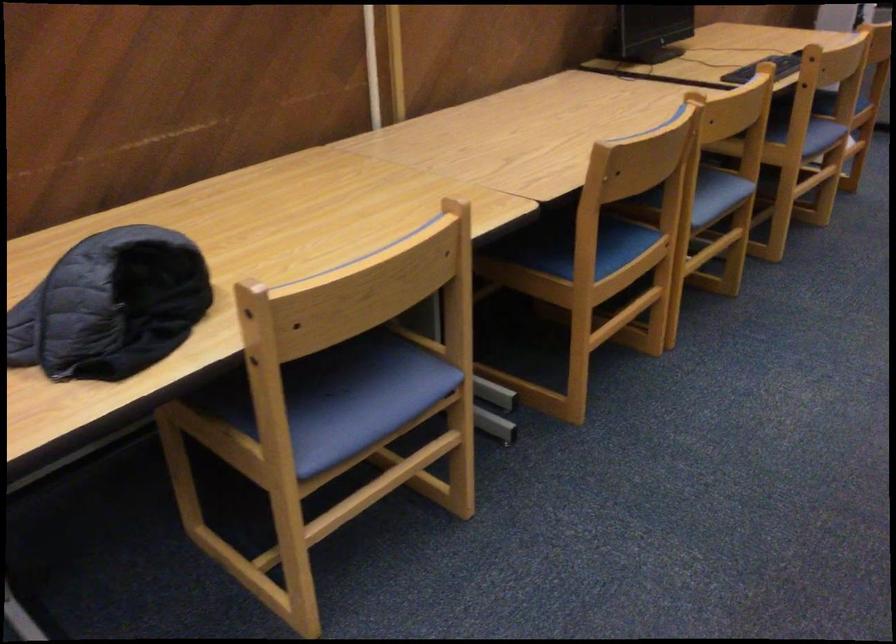
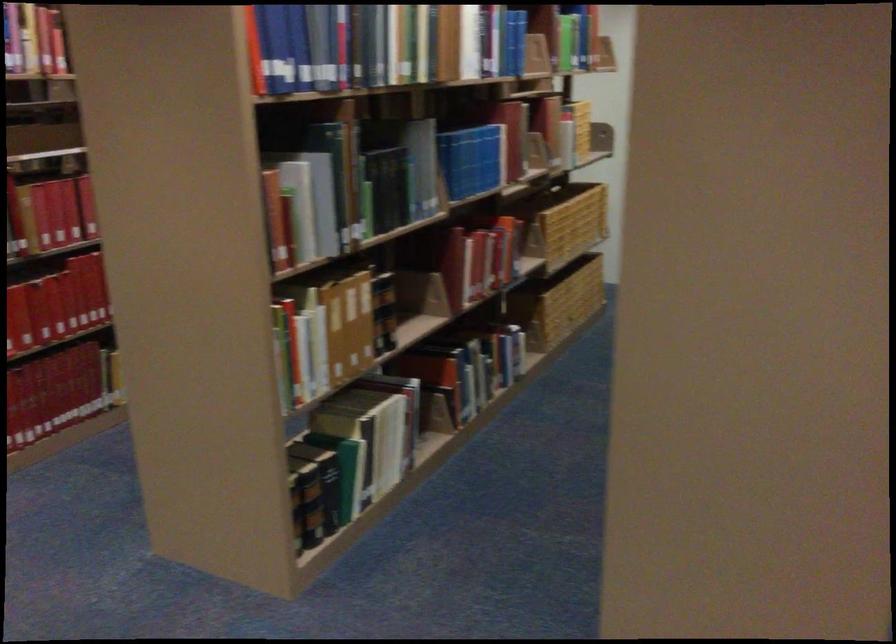
The images are taken continuously from a first-person perspective. In which direction is your viewpoint rotating?

The camera's rotation is toward right-down.